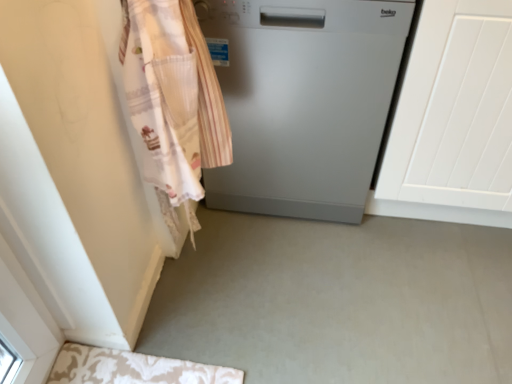
Question: Is white lace apron at left positioned behind white textured door at right?

Choices:
 (A) yes
 (B) no

Answer: (B)

Question: Considering the relative sizes of white lace apron at left and white textured door at right in the image provided, is white lace apron at left smaller than white textured door at right?

Choices:
 (A) yes
 (B) no

Answer: (A)

Question: Is white lace apron at left positioned before white textured door at right?

Choices:
 (A) no
 (B) yes

Answer: (B)

Question: From the image's perspective, is white lace apron at left on top of white textured door at right?

Choices:
 (A) no
 (B) yes

Answer: (A)

Question: From a real-world perspective, is white lace apron at left on white textured door at right?

Choices:
 (A) yes
 (B) no

Answer: (A)

Question: Can you confirm if white lace apron at left is bigger than white textured door at right?

Choices:
 (A) yes
 (B) no

Answer: (B)

Question: Is satin silver dishwasher at center positioned before white lace apron at left?

Choices:
 (A) yes
 (B) no

Answer: (B)

Question: From the image's perspective, does satin silver dishwasher at center appear higher than white lace apron at left?

Choices:
 (A) yes
 (B) no

Answer: (A)

Question: Can white lace apron at left be found inside satin silver dishwasher at center?

Choices:
 (A) no
 (B) yes

Answer: (A)

Question: From a real-world perspective, is satin silver dishwasher at center physically below white lace apron at left?

Choices:
 (A) no
 (B) yes

Answer: (B)

Question: Is there a large distance between satin silver dishwasher at center and white lace apron at left?

Choices:
 (A) no
 (B) yes

Answer: (A)

Question: Does satin silver dishwasher at center have a lesser height compared to white lace apron at left?

Choices:
 (A) yes
 (B) no

Answer: (A)

Question: Considering the relative sizes of white lace apron at left and satin silver dishwasher at center in the image provided, is white lace apron at left wider than satin silver dishwasher at center?

Choices:
 (A) yes
 (B) no

Answer: (B)